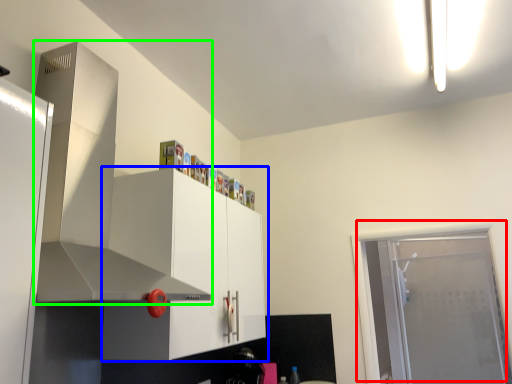
Question: Based on their relative distances, which object is nearer to door (highlighted by a red box)? Choose from cabinetry (highlighted by a blue box) and exhaust hood (highlighted by a green box).

Choices:
 (A) cabinetry
 (B) exhaust hood

Answer: (A)